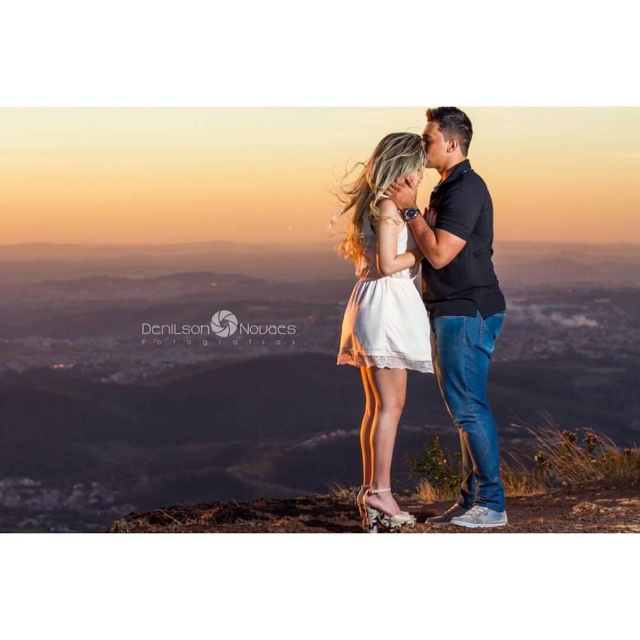
You are a photographer trying to capture the couple in the sunset. You want to ensure both the black cotton shirt at center and the white lace dress at center are in focus. Given that your camera has a depth of field that can cover 35 centimeters, will both items be in focus?

The black cotton shirt at center is 36.28 centimeters away from the white lace dress at center. Since the distance between them exceeds the camera sensor depth of field of 35 centimeters, both items may not be in focus simultaneously.

Consider the image. You are a photographer taking a picture of the black cotton shirt at center and the white lace dress at center. Which clothing item will appear larger in the photo?

The black cotton shirt at center will appear larger in the photo because it is taller than the white lace dress at center.

You are a photographer capturing this romantic sunset scene. You notice the black cotton shirt at center and the white lace dress at center. Which clothing item is closer to your camera lens?

The black cotton shirt at center is closer to the camera lens because it is positioned further to the viewer than the white lace dress at center.